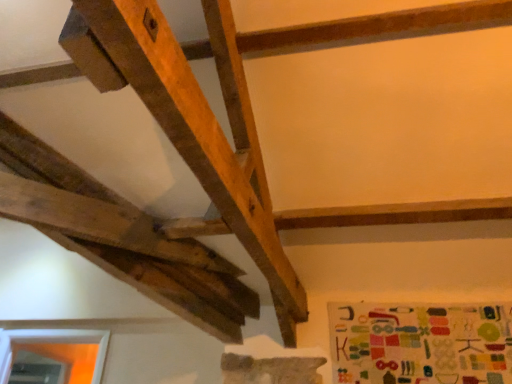
This screenshot has height=384, width=512. Identify the location of multicolored fabric bulletin board at lower right. (421, 343).

What do you see at coordinates (421, 343) in the screenshot?
I see `multicolored fabric bulletin board at lower right` at bounding box center [421, 343].

The width and height of the screenshot is (512, 384). I want to click on multicolored fabric bulletin board at lower right, so click(421, 343).